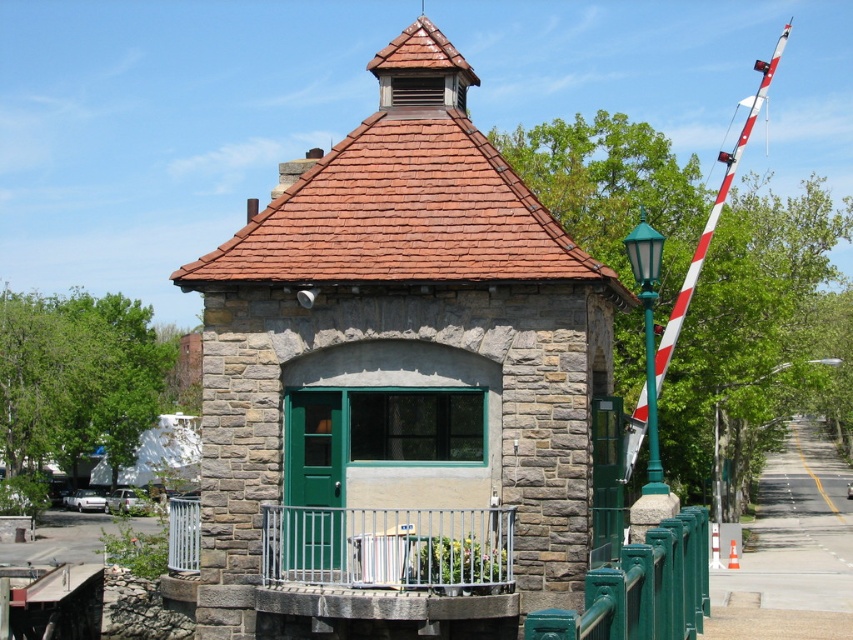
Who is positioned more to the right, stone gazebo at center or white/red striped pole at right?

From the viewer's perspective, white/red striped pole at right appears more on the right side.

Which is in front, point (321, 298) or point (720, 205)?

Positioned in front is point (321, 298).

Locate an element on the screen. stone gazebo at center is located at coordinates (398, 365).